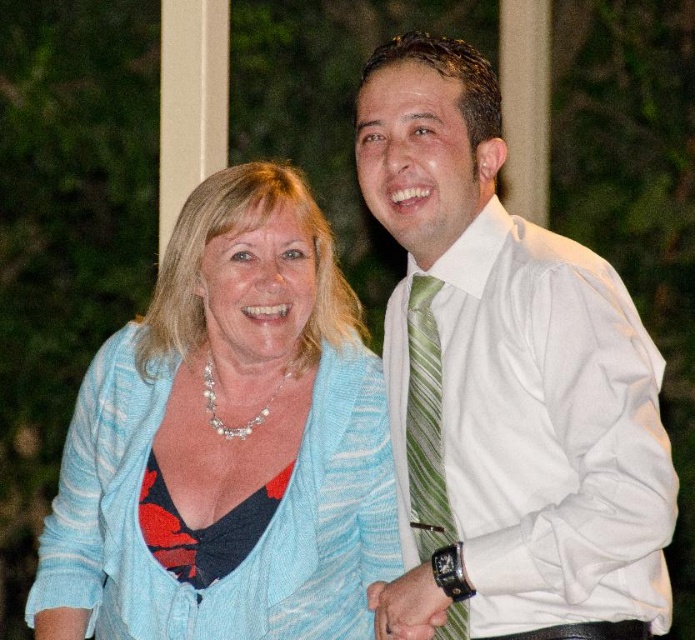
Does white smooth shirt at center have a greater height compared to green striped tie at right?

Yes.

Does point (605, 588) lie behind point (450, 524)?

That is False.

Locate an element on the screen. The height and width of the screenshot is (640, 695). white smooth shirt at center is located at coordinates (505, 385).

Is point (486, 120) closer to viewer compared to point (291, 180)?

Yes, it is.

Which is in front, point (605, 547) or point (297, 256)?

Point (605, 547)

This screenshot has height=640, width=695. I want to click on white smooth shirt at center, so click(505, 385).

Based on the photo, is light blue knit cardigan at center shorter than green striped tie at right?

In fact, light blue knit cardigan at center may be taller than green striped tie at right.

Which is more to the left, light blue knit cardigan at center or green striped tie at right?

light blue knit cardigan at center

Who is more forward, (42,605) or (432,451)?

Positioned in front is point (432,451).

The image size is (695, 640). Find the location of `light blue knit cardigan at center`. light blue knit cardigan at center is located at coordinates (227, 442).